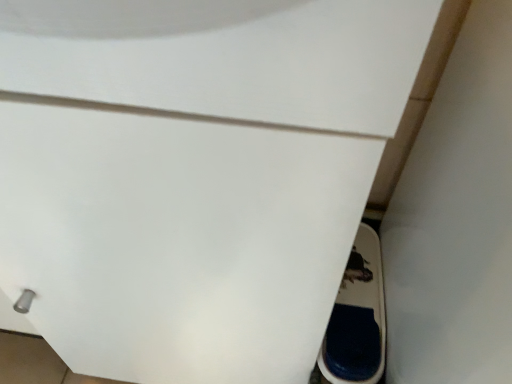
What do you see at coordinates (357, 318) in the screenshot? The width and height of the screenshot is (512, 384). I see `blue rubber boot at lower right` at bounding box center [357, 318].

Find the location of `blue rubber boot at lower right`. blue rubber boot at lower right is located at coordinates (357, 318).

Locate an element on the screen. This screenshot has width=512, height=384. blue rubber boot at lower right is located at coordinates (357, 318).